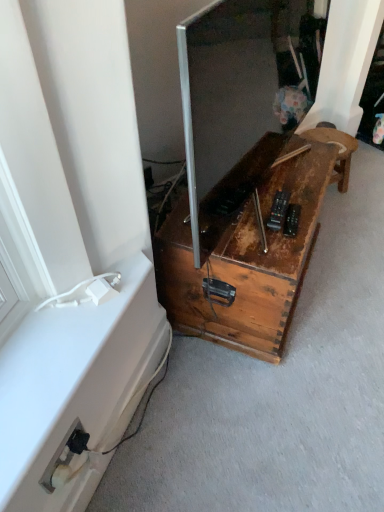
The width and height of the screenshot is (384, 512). I want to click on blank space situated above rusty wood trunk at lower right, marked as the 2th furniture in a right-to-left arrangement (from a real-world perspective), so (x=269, y=190).